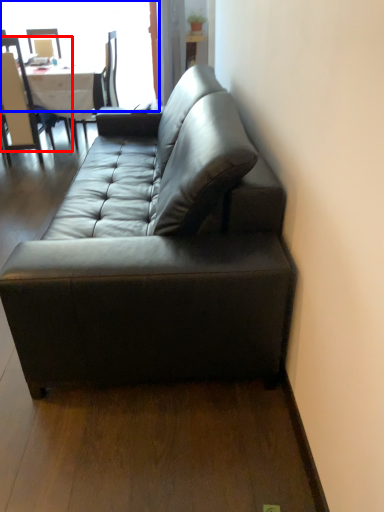
Question: Which object appears closest to the camera in this image, chair (highlighted by a red box) or window (highlighted by a blue box)?

Choices:
 (A) chair
 (B) window

Answer: (A)